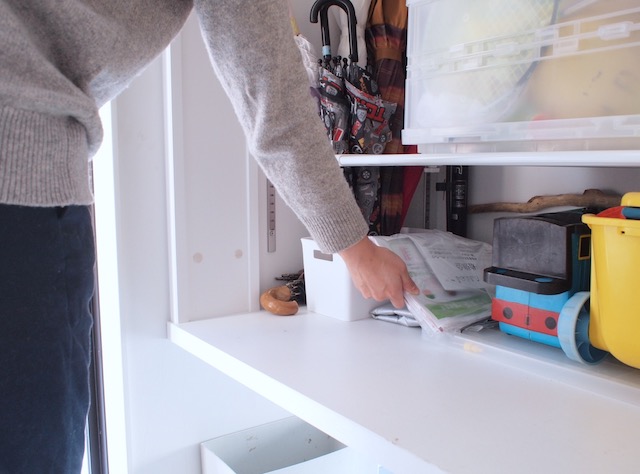
Locate an element on the screen. The width and height of the screenshot is (640, 474). basket is located at coordinates (326, 294).